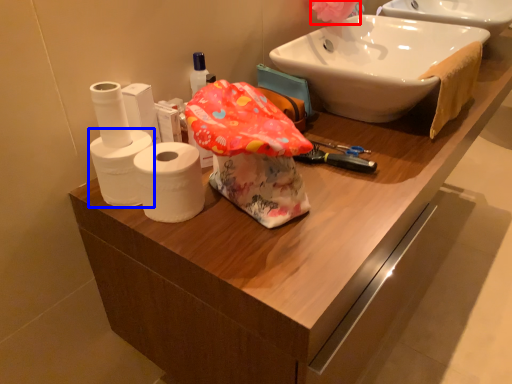
Question: Which object appears closest to the camera in this image, flower (highlighted by a red box) or toilet paper (highlighted by a blue box)?

Choices:
 (A) flower
 (B) toilet paper

Answer: (B)